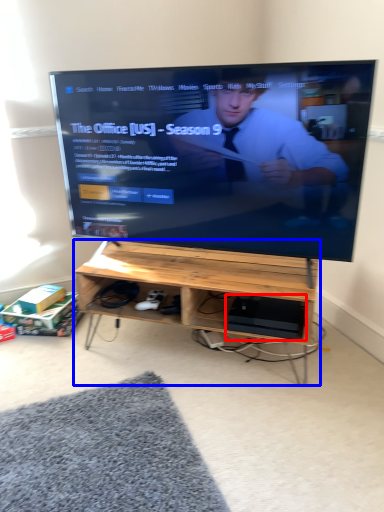
Question: Which point is closer to the camera, computer (highlighted by a red box) or desk (highlighted by a blue box)?

Choices:
 (A) computer
 (B) desk

Answer: (B)